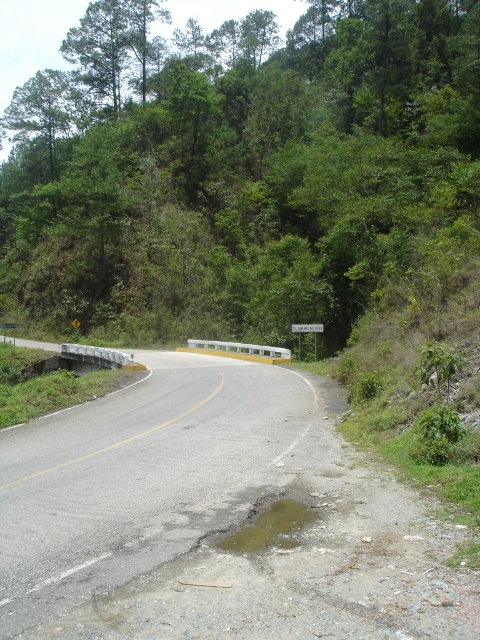
Question: Is green leafy tree at upper center positioned at the back of asphalt road at center?

Choices:
 (A) yes
 (B) no

Answer: (A)

Question: Which object appears closest to the camera in this image?

Choices:
 (A) green leafy tree at upper center
 (B) white plastic sign at center
 (C) asphalt road at center

Answer: (C)

Question: Which of these objects is positioned farthest from the white plastic sign at center?

Choices:
 (A) asphalt road at center
 (B) green leafy tree at upper center

Answer: (B)

Question: Does green leafy tree at upper center appear under white plastic sign at center?

Choices:
 (A) yes
 (B) no

Answer: (B)

Question: Based on their relative distances, which object is farther from the white plastic sign at center?

Choices:
 (A) green leafy tree at upper center
 (B) asphalt road at center

Answer: (A)

Question: Can you confirm if green leafy tree at upper center is positioned to the right of white plastic sign at center?

Choices:
 (A) no
 (B) yes

Answer: (A)